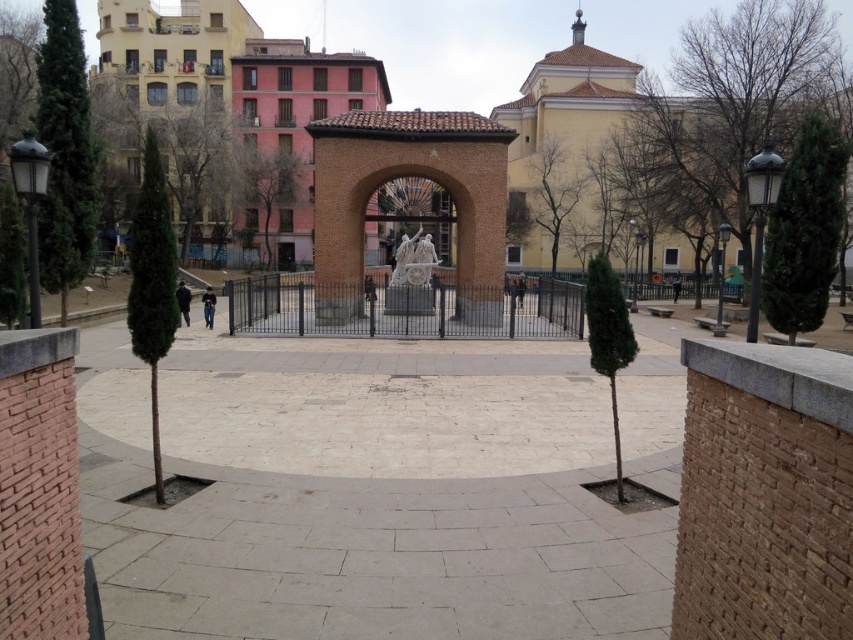
You are a visitor in the plaza and want to take a photo of both the brown brick archway at center and the brick textured archway at center. Since you have a camera with a fixed focal length, you need to know which one is taller to adjust your framing. Can you tell me which archway is taller?

The brown brick archway at center is much taller than the brick textured archway at center, so you should focus on framing the brown brick archway at center first as it requires more vertical space.

Consider the image. You are standing in the public square and want to walk through the archway to see the statue. Which archway should you go through, the brown brick archway at center or the brick textured archway at center?

The brown brick archway at center is located above the brick textured archway at center, so you should go through the brick textured archway at center since it is the lower one and accessible for walking through.